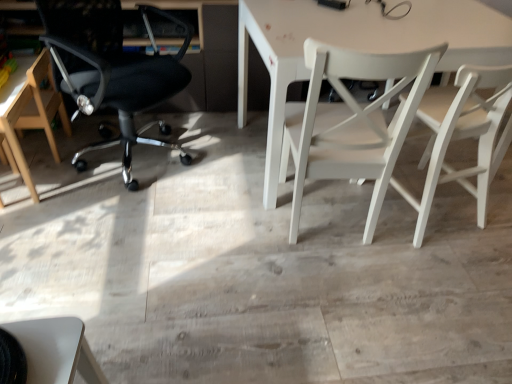
The image size is (512, 384). What do you see at coordinates (353, 122) in the screenshot?
I see `white matte chair at center, the third chair from the left` at bounding box center [353, 122].

Find the location of a particular element. The width and height of the screenshot is (512, 384). wooden floor at center is located at coordinates (257, 269).

What do you see at coordinates (257, 269) in the screenshot? Image resolution: width=512 pixels, height=384 pixels. I see `wooden floor at center` at bounding box center [257, 269].

The width and height of the screenshot is (512, 384). What do you see at coordinates (463, 136) in the screenshot?
I see `white wood chair at right, placed as the fourth chair when sorted from left to right` at bounding box center [463, 136].

Identify the location of white wood chair at right, which is the 1th chair in right-to-left order. The width and height of the screenshot is (512, 384). (463, 136).

How much space does black mesh office chair at left, which is counted as the 3th chair, starting from the right, occupy vertically?

36.46 inches.

What do you see at coordinates (112, 71) in the screenshot? The height and width of the screenshot is (384, 512). I see `black mesh office chair at left, which is counted as the 3th chair, starting from the right` at bounding box center [112, 71].

This screenshot has width=512, height=384. I want to click on light brown wooden chair at left, which is the 1th chair from left to right, so click(30, 111).

Is black mesh office chair at left, the 2th chair in the left-to-right sequence, located outside white wood chair at right, placed as the fourth chair when sorted from left to right?

Absolutely, black mesh office chair at left, the 2th chair in the left-to-right sequence, is external to white wood chair at right, placed as the fourth chair when sorted from left to right.

Considering the relative sizes of black mesh office chair at left, the 2th chair in the left-to-right sequence, and white wood chair at right, which is the 1th chair in right-to-left order, in the image provided, is black mesh office chair at left, the 2th chair in the left-to-right sequence, taller than white wood chair at right, which is the 1th chair in right-to-left order,?

Yes, black mesh office chair at left, the 2th chair in the left-to-right sequence, is taller than white wood chair at right, which is the 1th chair in right-to-left order.

From a real-world perspective, is black mesh office chair at left, the 2th chair in the left-to-right sequence, below white wood chair at right, placed as the fourth chair when sorted from left to right?

No, from a real-world perspective, black mesh office chair at left, the 2th chair in the left-to-right sequence, is not under white wood chair at right, placed as the fourth chair when sorted from left to right.

Who is taller, wooden floor at center or white wood chair at right, which is the 1th chair in right-to-left order?

With more height is white wood chair at right, which is the 1th chair in right-to-left order.

From a real-world perspective, between wooden floor at center and white wood chair at right, which is the 1th chair in right-to-left order, who is vertically lower?

wooden floor at center, from a real-world perspective.

Image resolution: width=512 pixels, height=384 pixels. I want to click on concrete in front of the white wood chair at right, which is the 1th chair in right-to-left order, so click(x=257, y=269).

Is light brown wooden chair at left, which is the 1th chair from left to right, not inside white matte chair at center, the third chair from the left?

Yes, light brown wooden chair at left, which is the 1th chair from left to right, is not within white matte chair at center, the third chair from the left.

In the scene shown: From the image's perspective, is light brown wooden chair at left, which is the 1th chair from left to right, over white matte chair at center, the third chair from the left?

Indeed, from the image's perspective, light brown wooden chair at left, which is the 1th chair from left to right, is shown above white matte chair at center, the third chair from the left.

Is the position of light brown wooden chair at left, which is the 1th chair from left to right, more distant than that of white matte chair at center, the 2th chair from the right?

Yes, it is behind white matte chair at center, the 2th chair from the right.

Is point (49, 66) less distant than point (302, 148)?

No, (49, 66) is behind (302, 148).

Would you say wooden floor at center is to the left or to the right of light brown wooden chair at left, marked as the fourth chair in a right-to-left arrangement, in the picture?

From the image, it's evident that wooden floor at center is to the right of light brown wooden chair at left, marked as the fourth chair in a right-to-left arrangement.

Is wooden floor at center looking in the opposite direction of light brown wooden chair at left, which is the 1th chair from left to right?

No, wooden floor at center is not facing away from light brown wooden chair at left, which is the 1th chair from left to right.

Considering the relative sizes of wooden floor at center and light brown wooden chair at left, marked as the fourth chair in a right-to-left arrangement, in the image provided, is wooden floor at center wider than light brown wooden chair at left, marked as the fourth chair in a right-to-left arrangement,?

Yes, wooden floor at center is wider than light brown wooden chair at left, marked as the fourth chair in a right-to-left arrangement.

Is wooden floor at center touching light brown wooden chair at left, which is the 1th chair from left to right?

No.

Is light brown wooden chair at left, which is the 1th chair from left to right, looking in the opposite direction of white wood chair at right, placed as the fourth chair when sorted from left to right?

No.

Measure the distance from light brown wooden chair at left, marked as the fourth chair in a right-to-left arrangement, to white wood chair at right, placed as the fourth chair when sorted from left to right.

light brown wooden chair at left, marked as the fourth chair in a right-to-left arrangement, and white wood chair at right, placed as the fourth chair when sorted from left to right, are 6.09 feet apart from each other.

From the image's perspective, would you say light brown wooden chair at left, marked as the fourth chair in a right-to-left arrangement, is shown under white wood chair at right, which is the 1th chair in right-to-left order?

No, from the image's perspective, light brown wooden chair at left, marked as the fourth chair in a right-to-left arrangement, is not below white wood chair at right, which is the 1th chair in right-to-left order.

Considering the positions of objects light brown wooden chair at left, marked as the fourth chair in a right-to-left arrangement, and white wood chair at right, which is the 1th chair in right-to-left order, in the image provided, who is in front, light brown wooden chair at left, marked as the fourth chair in a right-to-left arrangement, or white wood chair at right, which is the 1th chair in right-to-left order,?

Positioned in front is white wood chair at right, which is the 1th chair in right-to-left order.

Considering the relative sizes of black mesh office chair at left, which is counted as the 3th chair, starting from the right, and wooden floor at center in the image provided, is black mesh office chair at left, which is counted as the 3th chair, starting from the right, bigger than wooden floor at center?

Indeed, black mesh office chair at left, which is counted as the 3th chair, starting from the right, has a larger size compared to wooden floor at center.

Is black mesh office chair at left, the 2th chair in the left-to-right sequence, completely or partially outside of wooden floor at center?

Yes, black mesh office chair at left, the 2th chair in the left-to-right sequence, is outside of wooden floor at center.

From the image's perspective, is black mesh office chair at left, which is counted as the 3th chair, starting from the right, over wooden floor at center?

Correct, black mesh office chair at left, which is counted as the 3th chair, starting from the right, appears higher than wooden floor at center in the image.

Is black mesh office chair at left, which is counted as the 3th chair, starting from the right, aimed at wooden floor at center?

Yes, black mesh office chair at left, which is counted as the 3th chair, starting from the right, faces towards wooden floor at center.

From the image's perspective, relative to white matte table at center, is wooden floor at center above or below?

wooden floor at center is below white matte table at center.

From a real-world perspective, which object stands above the other?

white matte table at center.

Does wooden floor at center have a greater width compared to white matte table at center?

Correct, the width of wooden floor at center exceeds that of white matte table at center.

Is the position of wooden floor at center less distant than that of white matte table at center?

Yes, the depth of wooden floor at center is less than that of white matte table at center.

I want to click on chair that is the 2nd one when counting rightward from the black mesh office chair at left, which is counted as the 3th chair, starting from the right, so pyautogui.click(x=463, y=136).

Where is `concrete on the left side of white wood chair at right, placed as the fourth chair when sorted from left to right`? This screenshot has width=512, height=384. concrete on the left side of white wood chair at right, placed as the fourth chair when sorted from left to right is located at coordinates (257, 269).

When comparing their distances from light brown wooden chair at left, which is the 1th chair from left to right, does black mesh office chair at left, which is counted as the 3th chair, starting from the right, or wooden floor at center seem closer?

black mesh office chair at left, which is counted as the 3th chair, starting from the right, is positioned closer to the anchor light brown wooden chair at left, which is the 1th chair from left to right.

When comparing their distances from wooden floor at center, does white matte chair at center, the 2th chair from the right, or white matte table at center seem further?

white matte table at center lies further to wooden floor at center than the other object.

Considering their positions, is light brown wooden chair at left, marked as the fourth chair in a right-to-left arrangement, positioned further to wooden floor at center than white matte table at center?

light brown wooden chair at left, marked as the fourth chair in a right-to-left arrangement.

When comparing their distances from light brown wooden chair at left, marked as the fourth chair in a right-to-left arrangement, does white matte chair at center, the 2th chair from the right, or black mesh office chair at left, the 2th chair in the left-to-right sequence, seem closer?

The object closer to light brown wooden chair at left, marked as the fourth chair in a right-to-left arrangement, is black mesh office chair at left, the 2th chair in the left-to-right sequence.

Based on their spatial positions, is wooden floor at center or black mesh office chair at left, the 2th chair in the left-to-right sequence, further from light brown wooden chair at left, marked as the fourth chair in a right-to-left arrangement?

Based on the image, wooden floor at center appears to be further to light brown wooden chair at left, marked as the fourth chair in a right-to-left arrangement.

In the scene shown: From the image, which object appears to be nearer to white matte table at center, black mesh office chair at left, which is counted as the 3th chair, starting from the right, or light brown wooden chair at left, marked as the fourth chair in a right-to-left arrangement?

black mesh office chair at left, which is counted as the 3th chair, starting from the right, is closer to white matte table at center.

From the image, which object appears to be farther from white matte chair at center, the third chair from the left, white matte table at center or black mesh office chair at left, which is counted as the 3th chair, starting from the right?

black mesh office chair at left, which is counted as the 3th chair, starting from the right, is further to white matte chair at center, the third chair from the left.

Which object lies nearer to the anchor point black mesh office chair at left, the 2th chair in the left-to-right sequence, white matte table at center or wooden floor at center?

white matte table at center is positioned closer to the anchor black mesh office chair at left, the 2th chair in the left-to-right sequence.

The image size is (512, 384). Identify the location of chair situated between wooden floor at center and white wood chair at right, placed as the fourth chair when sorted from left to right, from left to right. (353, 122).

Locate an element on the screen. The width and height of the screenshot is (512, 384). table between wooden floor at center and white wood chair at right, placed as the fourth chair when sorted from left to right, in the horizontal direction is located at coordinates coord(356,47).

The height and width of the screenshot is (384, 512). What are the coordinates of `concrete situated between black mesh office chair at left, the 2th chair in the left-to-right sequence, and white matte table at center from left to right` in the screenshot? It's located at (257, 269).

Locate an element on the screen. chair between light brown wooden chair at left, which is the 1th chair from left to right, and white matte chair at center, the third chair from the left, from left to right is located at coordinates (112, 71).